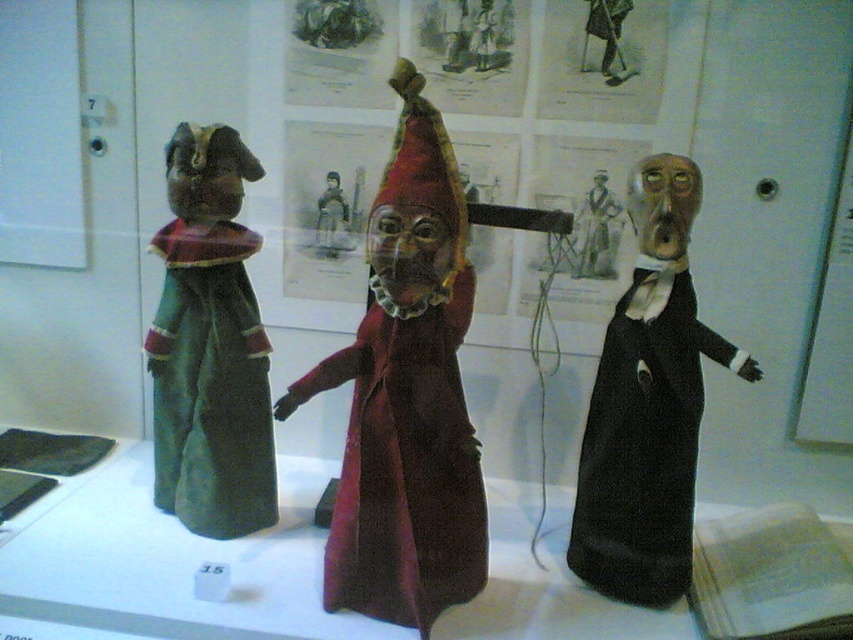
Does green felt doll at left appear on the left side of black velvet dress at right?

Yes, green felt doll at left is to the left of black velvet dress at right.

Is point (239, 451) positioned after point (656, 300)?

Yes.

At what (x,y) coordinates should I click in order to perform the action: click on green felt doll at left. Please return your answer as a coordinate pair (x, y). This screenshot has width=853, height=640. Looking at the image, I should click on (210, 346).

Does velvet maroon coat at center have a greater width compared to green felt doll at left?

Correct, the width of velvet maroon coat at center exceeds that of green felt doll at left.

Does velvet maroon coat at center appear under green felt doll at left?

Indeed, velvet maroon coat at center is positioned under green felt doll at left.

What are the coordinates of `velvet maroon coat at center` in the screenshot? It's located at (403, 467).

The height and width of the screenshot is (640, 853). In order to click on velvet maroon coat at center in this screenshot , I will do `click(403, 467)`.

Between velvet maroon coat at center and black velvet dress at right, which one is positioned higher?

velvet maroon coat at center is above.

Measure the distance between velvet maroon coat at center and camera.

velvet maroon coat at center is 1.28 meters away from camera.

Which is behind, point (457, 397) or point (618, 534)?

Point (618, 534)

At what (x,y) coordinates should I click in order to perform the action: click on velvet maroon coat at center. Please return your answer as a coordinate pair (x, y). The height and width of the screenshot is (640, 853). Looking at the image, I should click on (403, 467).